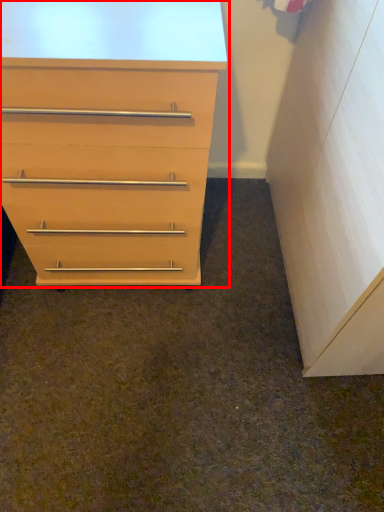
Question: In this image, where is chest of drawers (annotated by the red box) located relative to file cabinet?

Choices:
 (A) right
 (B) left

Answer: (B)